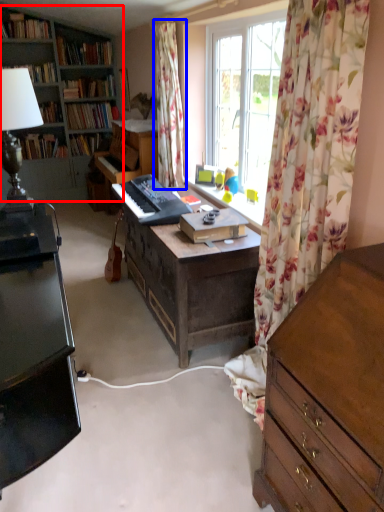
Question: Which object is closer to the camera taking this photo, bookcase (highlighted by a red box) or curtain (highlighted by a blue box)?

Choices:
 (A) bookcase
 (B) curtain

Answer: (B)